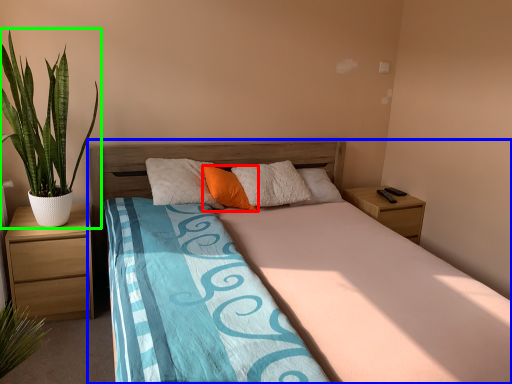
Question: Which object is the farthest from pillow (highlighted by a red box)? Choose among these: bed (highlighted by a blue box) or houseplant (highlighted by a green box).

Choices:
 (A) bed
 (B) houseplant

Answer: (B)